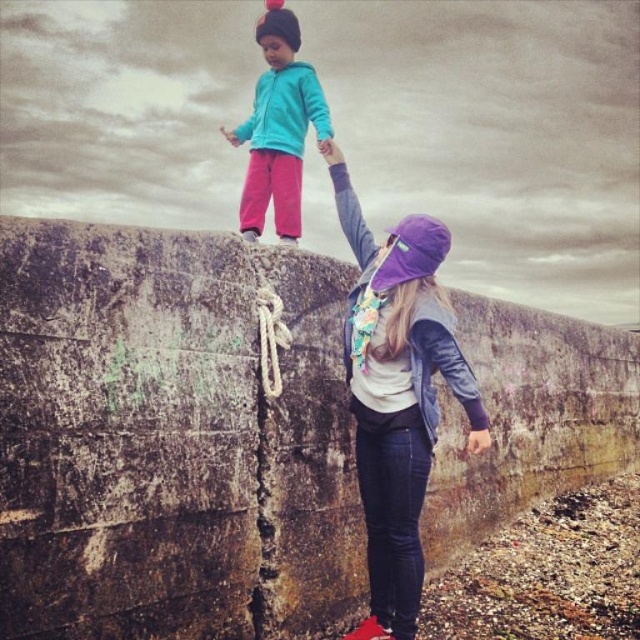
Question: Does purple fabric hat at upper center appear on the right side of turquoise fleece jacket at upper center?

Choices:
 (A) yes
 (B) no

Answer: (A)

Question: Based on their relative distances, which object is farther from the purple fabric hat at upper center?

Choices:
 (A) rusty concrete wall at upper center
 (B) white woven rope at center
 (C) turquoise fleece jacket at upper center

Answer: (C)

Question: Considering the relative positions of purple fabric hat at upper center and turquoise fleece jacket at upper center in the image provided, where is purple fabric hat at upper center located with respect to turquoise fleece jacket at upper center?

Choices:
 (A) right
 (B) left

Answer: (A)

Question: Which point is farther from the camera taking this photo?

Choices:
 (A) (76, 522)
 (B) (241, 132)

Answer: (B)

Question: Which point is closer to the camera?

Choices:
 (A) rusty concrete wall at upper center
 (B) turquoise fleece jacket at upper center

Answer: (A)

Question: Where is purple fabric hat at upper center located in relation to turquoise fleece jacket at upper center in the image?

Choices:
 (A) above
 (B) below

Answer: (B)